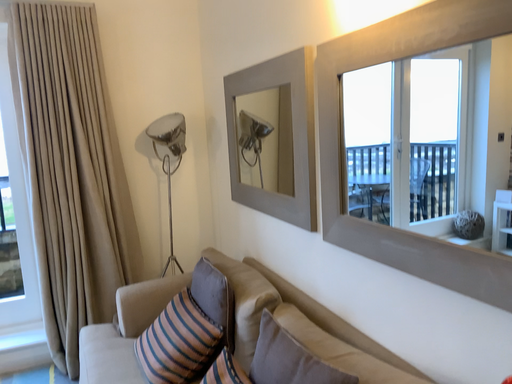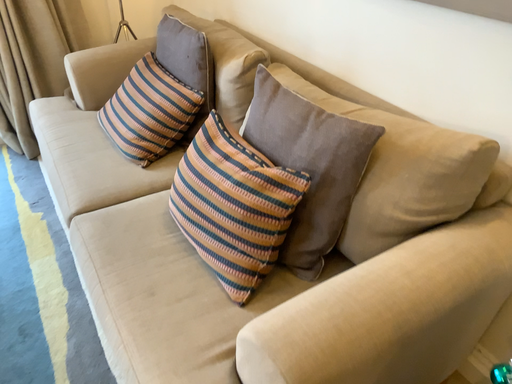
Question: Which way did the camera rotate in the video?

Choices:
 (A) rotated left
 (B) rotated right

Answer: (B)